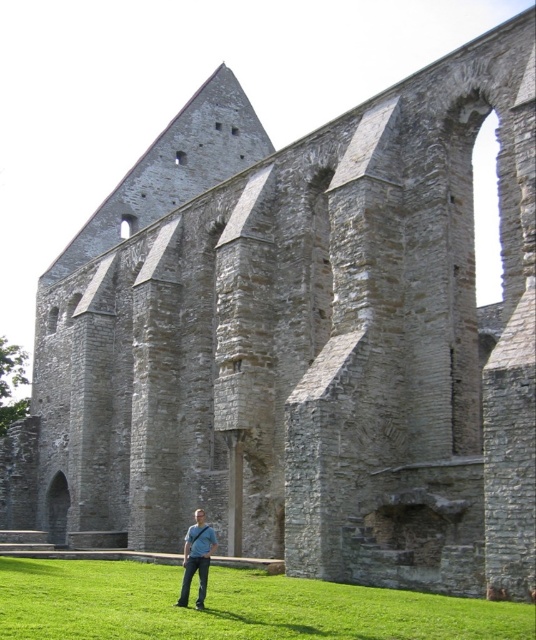
Question: Does green grass at lower center appear on the right side of blue denim jeans at lower center?

Choices:
 (A) no
 (B) yes

Answer: (A)

Question: Which point is farther from the camera taking this photo?

Choices:
 (A) (215, 540)
 (B) (51, 624)

Answer: (A)

Question: Which of the following is the farthest from the observer?

Choices:
 (A) (189, 614)
 (B) (188, 579)

Answer: (B)

Question: Does green grass at lower center appear under blue denim jeans at lower center?

Choices:
 (A) yes
 (B) no

Answer: (A)

Question: Among these points, which one is nearest to the camera?

Choices:
 (A) (193, 513)
 (B) (479, 636)

Answer: (B)

Question: Where is green grass at lower center located in relation to blue denim jeans at lower center in the image?

Choices:
 (A) above
 (B) below

Answer: (B)